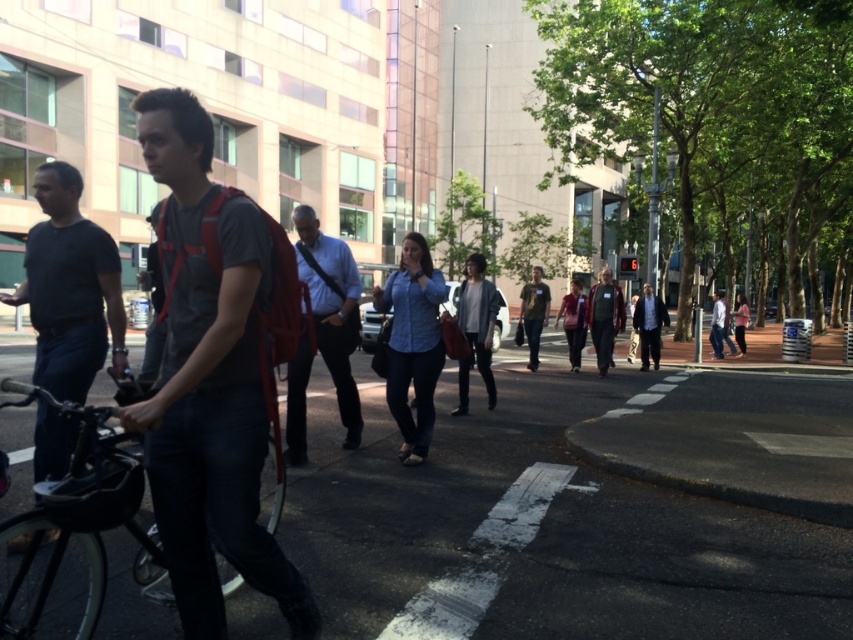
You are standing at the pedestrian crossing in the image. There is a point marked at coordinates (412, 342). What object is located at that point?

The point at coordinates (412, 342) corresponds to the denim shirt at center.

You are standing on the pedestrian crossing and want to walk towards the point that is closer to you. Which point should you head towards, point (210, 572) or point (19, 536)?

You should head towards point (210, 572) because it is closer to the viewer than point (19, 536).